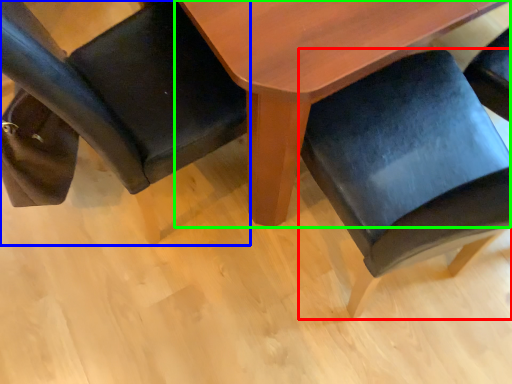
Question: Which object is the farthest from chair (highlighted by a red box)? Choose among these: chair (highlighted by a blue box) or table (highlighted by a green box).

Choices:
 (A) chair
 (B) table

Answer: (A)